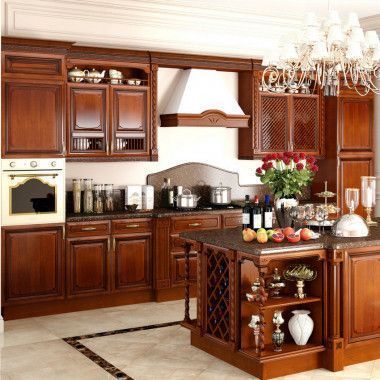
Identify the location of door. This screenshot has height=380, width=380. (41, 129).